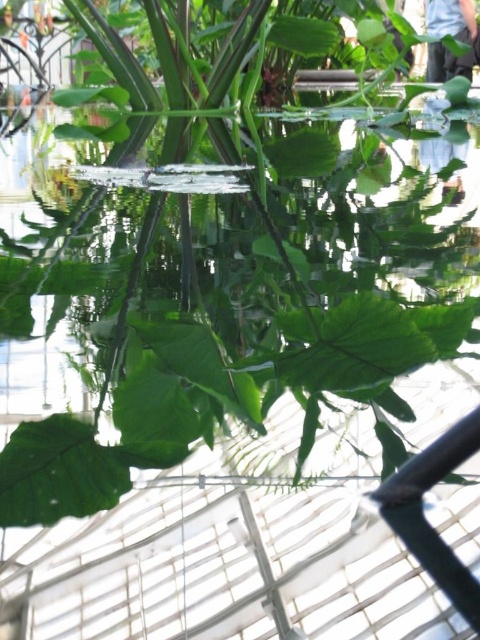
You are holding a small remote control that needs to be placed on the transparent liquid water at center. The remote control is 10 centimeters long. Can you place it entirely on the water without any part hanging over the edge?

The transparent liquid water at center and viewer are 39.20 centimeters apart. Since the remote control is only 10 centimeters long, it can easily be placed entirely on the water without any part hanging over the edge as there is sufficient space.

Consider the image. You are standing in the greenhouse and want to pour the liquid from the transparent liquid water at center into a container located near the blue jeans at upper right. Which direction should you move to reach the container?

The transparent liquid water at center is to the left of blue jeans at upper right, so you should move to the right to reach the container near the blue jeans at upper right.

You are standing in the greenhouse and see the transparent liquid water at center and the blue jeans at upper right. Which object is closer to you?

The transparent liquid water at center is closer to you because it is in front of the blue jeans at upper right.